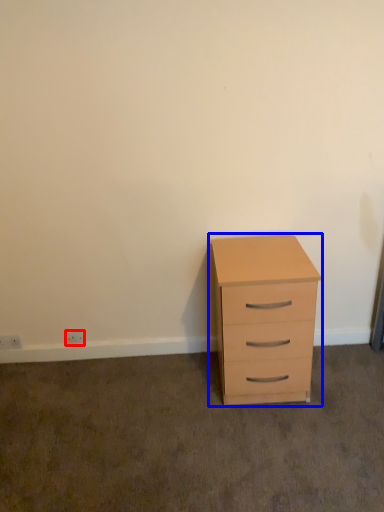
Question: Which object appears closest to the camera in this image, electric outlet (highlighted by a red box) or chest of drawers (highlighted by a blue box)?

Choices:
 (A) electric outlet
 (B) chest of drawers

Answer: (B)